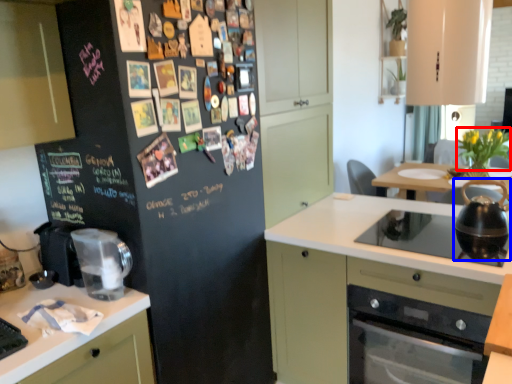
Question: Which object appears farthest to the camera in this image, flower (highlighted by a red box) or kitchen appliance (highlighted by a blue box)?

Choices:
 (A) flower
 (B) kitchen appliance

Answer: (A)